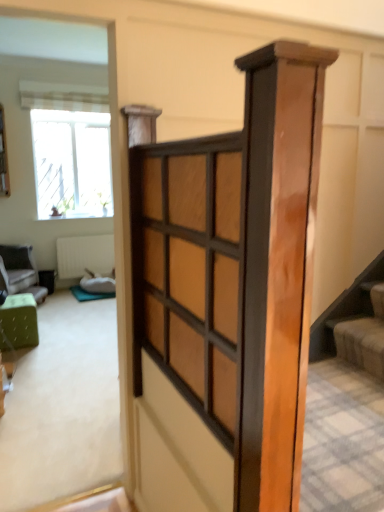
Question: Can you confirm if green fabric ottoman at left, placed as the second furniture when sorted from right to left, is wider than white textured radiator at center?

Choices:
 (A) yes
 (B) no

Answer: (A)

Question: Are green fabric ottoman at left, the 1th furniture from the back, and white textured radiator at center far apart?

Choices:
 (A) no
 (B) yes

Answer: (A)

Question: Could you tell me if green fabric ottoman at left, which is the second furniture in front-to-back order, is turned towards white textured radiator at center?

Choices:
 (A) no
 (B) yes

Answer: (A)

Question: Is green fabric ottoman at left, positioned as the first furniture in left-to-right order, closer to the viewer compared to white textured radiator at center?

Choices:
 (A) yes
 (B) no

Answer: (A)

Question: From the image's perspective, is green fabric ottoman at left, positioned as the first furniture in left-to-right order, located above white textured radiator at center?

Choices:
 (A) no
 (B) yes

Answer: (A)

Question: Is green fabric ottoman at left, placed as the second furniture when sorted from right to left, positioned behind white textured radiator at center?

Choices:
 (A) yes
 (B) no

Answer: (B)

Question: Does green fabric ottoman at left, which is counted as the second furniture, starting from the back, have a smaller size compared to striped fabric curtain at upper left?

Choices:
 (A) no
 (B) yes

Answer: (B)

Question: Considering the relative positions of green fabric ottoman at left, which is the first furniture in right-to-left order, and striped fabric curtain at upper left in the image provided, is green fabric ottoman at left, which is the first furniture in right-to-left order, to the left of striped fabric curtain at upper left from the viewer's perspective?

Choices:
 (A) yes
 (B) no

Answer: (A)

Question: Is green fabric ottoman at left, which is counted as the second furniture, starting from the back, wider than striped fabric curtain at upper left?

Choices:
 (A) yes
 (B) no

Answer: (A)

Question: Does green fabric ottoman at left, which is the first furniture in right-to-left order, have a larger size compared to striped fabric curtain at upper left?

Choices:
 (A) yes
 (B) no

Answer: (B)

Question: Would you say striped fabric curtain at upper left is part of green fabric ottoman at left, which is the first furniture from front to back,'s contents?

Choices:
 (A) no
 (B) yes

Answer: (A)

Question: Could you tell me if green fabric ottoman at left, which is the first furniture from front to back, is turned towards striped fabric curtain at upper left?

Choices:
 (A) no
 (B) yes

Answer: (A)

Question: From a real-world perspective, is striped fabric curtain at upper left located higher than white textured radiator at center?

Choices:
 (A) no
 (B) yes

Answer: (B)